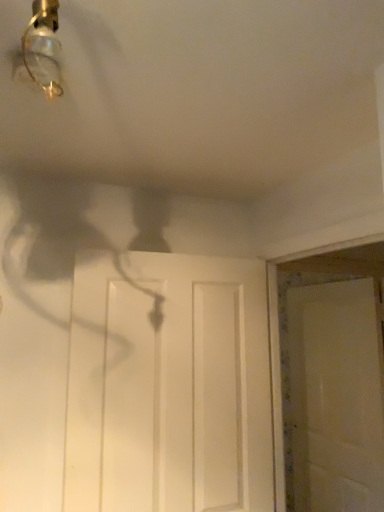
Question: Which direction should I rotate to look at white matte door at center, which ranks as the second door in left-to-right order, — up or down?

Choices:
 (A) up
 (B) down

Answer: (B)

Question: Which direction should I rotate to face white matte door at center, the 2th door when ordered from back to front, — up or down?

Choices:
 (A) up
 (B) down

Answer: (B)

Question: Is white matte door at center, the 1th door in the back-to-front sequence, far away from white matte door at center, the second door positioned from the right?

Choices:
 (A) no
 (B) yes

Answer: (B)

Question: Does white matte door at center, which is the first door from right to left, turn towards white matte door at center, acting as the 1th door starting from the left?

Choices:
 (A) no
 (B) yes

Answer: (B)

Question: Does white matte door at center, which ranks as the second door in left-to-right order, have a lesser width compared to white matte door at center, the first door viewed from the front?

Choices:
 (A) yes
 (B) no

Answer: (A)

Question: From the image's perspective, does white matte door at center, arranged as the second door when viewed from the front, appear higher than white matte door at center, the first door viewed from the front?

Choices:
 (A) yes
 (B) no

Answer: (B)

Question: Considering the relative sizes of white matte door at center, arranged as the second door when viewed from the front, and white matte door at center, the second door positioned from the right, in the image provided, is white matte door at center, arranged as the second door when viewed from the front, shorter than white matte door at center, the second door positioned from the right,?

Choices:
 (A) no
 (B) yes

Answer: (A)

Question: Does white matte door at center, arranged as the second door when viewed from the front, appear on the right side of white matte door at center, the first door viewed from the front?

Choices:
 (A) yes
 (B) no

Answer: (A)

Question: From a real-world perspective, does white matte door at center, acting as the 1th door starting from the left, stand above white matte door at center, the 1th door in the back-to-front sequence?

Choices:
 (A) no
 (B) yes

Answer: (B)

Question: Is the depth of white matte door at center, the second door positioned from the right, less than that of white matte door at center, which ranks as the second door in left-to-right order?

Choices:
 (A) yes
 (B) no

Answer: (A)

Question: Is white matte door at center, the 2th door when ordered from back to front, outside of white matte door at center, arranged as the second door when viewed from the front?

Choices:
 (A) no
 (B) yes

Answer: (B)

Question: From the image's perspective, is white matte door at center, the first door viewed from the front, on top of white matte door at center, which ranks as the second door in left-to-right order?

Choices:
 (A) no
 (B) yes

Answer: (B)

Question: From the image's perspective, would you say white matte door at center, the second door positioned from the right, is shown under white matte door at center, which ranks as the second door in left-to-right order?

Choices:
 (A) no
 (B) yes

Answer: (A)

Question: Considering the positions of point (340, 379) and point (256, 332), is point (340, 379) closer or farther from the camera than point (256, 332)?

Choices:
 (A) closer
 (B) farther

Answer: (B)